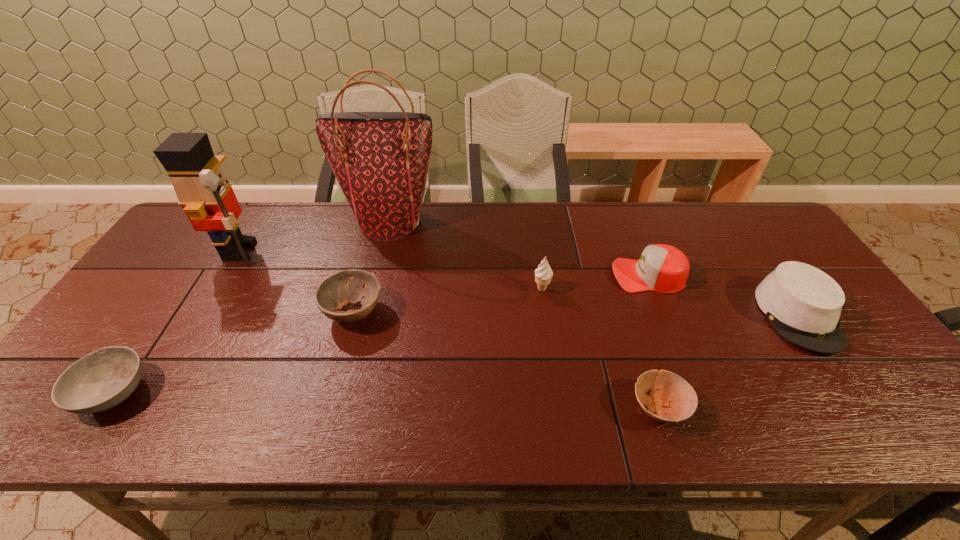
Find the location of a particular element. The height and width of the screenshot is (540, 960). free point between the hat and the rightmost bowl is located at coordinates (729, 362).

Identify which object is the third closest to the hat. Please provide its 2D coordinates. Your answer should be formatted as a tuple, i.e. [(x, y)], where the tuple contains the x and y coordinates of a point satisfying the conditions above.

[(543, 274)]

Identify which object is the sixth closest to the hat. Please provide its 2D coordinates. Your answer should be formatted as a tuple, i.e. [(x, y)], where the tuple contains the x and y coordinates of a point satisfying the conditions above.

[(204, 192)]

Point out which bowl is positioned as the nearest to the rightmost bowl. Please provide its 2D coordinates. Your answer should be formatted as a tuple, i.e. [(x, y)], where the tuple contains the x and y coordinates of a point satisfying the conditions above.

[(336, 292)]

Locate which bowl is the third closest to the nutcracker. Please provide its 2D coordinates. Your answer should be formatted as a tuple, i.e. [(x, y)], where the tuple contains the x and y coordinates of a point satisfying the conditions above.

[(675, 400)]

At what (x,y) coordinates should I click in order to perform the action: click on free point that satisfies the following two spatial constraints: 1. on the back side of the leftmost bowl; 2. on the left side of the second bowl from left to right. Please return your answer as a coordinate pair (x, y). The image size is (960, 540). Looking at the image, I should click on (167, 312).

The width and height of the screenshot is (960, 540). I want to click on vacant region that satisfies the following two spatial constraints: 1. on the front side of the rightmost bowl; 2. on the left side of the leftmost bowl, so click(103, 408).

I want to click on vacant space that satisfies the following two spatial constraints: 1. on the front-facing side of the baseball cap; 2. on the front-facing side of the icecream, so 654,289.